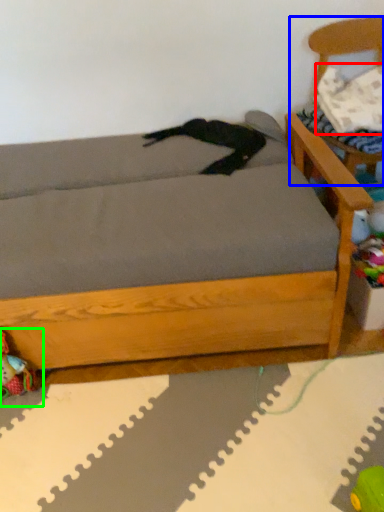
Question: Which is farther away from pillow (highlighted by a red box)? armchair (highlighted by a blue box) or toy (highlighted by a green box)?

Choices:
 (A) armchair
 (B) toy

Answer: (B)